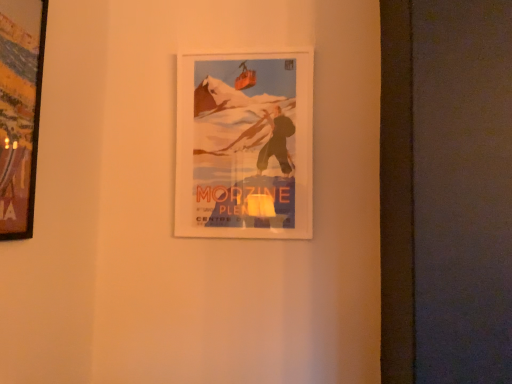
Question: From the image's perspective, is matte paper poster at center, the first picture frame from the right, on top of wooden frame at left, which is counted as the 2th picture frame, starting from the right?

Choices:
 (A) yes
 (B) no

Answer: (B)

Question: Is matte paper poster at center, arranged as the second picture frame when viewed from the left, wider than wooden frame at left, which is counted as the 2th picture frame, starting from the right?

Choices:
 (A) no
 (B) yes

Answer: (A)

Question: Can you see matte paper poster at center, the first picture frame from the right, touching wooden frame at left, which is counted as the 2th picture frame, starting from the right?

Choices:
 (A) yes
 (B) no

Answer: (B)

Question: Is the depth of matte paper poster at center, the first picture frame from the right, greater than that of wooden frame at left, which is counted as the 2th picture frame, starting from the right?

Choices:
 (A) no
 (B) yes

Answer: (B)

Question: Considering the relative sizes of matte paper poster at center, the 2th picture frame viewed from the front, and wooden frame at left, acting as the first picture frame starting from the front, in the image provided, is matte paper poster at center, the 2th picture frame viewed from the front, thinner than wooden frame at left, acting as the first picture frame starting from the front,?

Choices:
 (A) yes
 (B) no

Answer: (A)

Question: Can you confirm if matte paper poster at center, arranged as the second picture frame when viewed from the left, is positioned to the left of wooden frame at left, the 1th picture frame positioned from the left?

Choices:
 (A) no
 (B) yes

Answer: (A)

Question: Would you say wooden frame at left, the 1th picture frame positioned from the left, contains matte paper poster at center, arranged as the second picture frame when viewed from the left?

Choices:
 (A) yes
 (B) no

Answer: (B)

Question: Can we say wooden frame at left, which is counted as the 2th picture frame, starting from the right, lies outside matte paper poster at center, which appears as the first picture frame when viewed from the back?

Choices:
 (A) yes
 (B) no

Answer: (A)

Question: Considering the relative sizes of wooden frame at left, which is counted as the second picture frame, starting from the back, and matte paper poster at center, the 2th picture frame viewed from the front, in the image provided, is wooden frame at left, which is counted as the second picture frame, starting from the back, shorter than matte paper poster at center, the 2th picture frame viewed from the front,?

Choices:
 (A) yes
 (B) no

Answer: (A)

Question: From the image's perspective, is wooden frame at left, which is counted as the 2th picture frame, starting from the right, above matte paper poster at center, arranged as the second picture frame when viewed from the left?

Choices:
 (A) no
 (B) yes

Answer: (B)

Question: Does wooden frame at left, which is counted as the 2th picture frame, starting from the right, come in front of matte paper poster at center, arranged as the second picture frame when viewed from the left?

Choices:
 (A) no
 (B) yes

Answer: (B)

Question: From a real-world perspective, is wooden frame at left, which is counted as the second picture frame, starting from the back, on top of matte paper poster at center, which appears as the first picture frame when viewed from the back?

Choices:
 (A) no
 (B) yes

Answer: (A)

Question: From the image's perspective, is matte paper poster at center, which appears as the first picture frame when viewed from the back, above or below wooden frame at left, the 1th picture frame positioned from the left?

Choices:
 (A) below
 (B) above

Answer: (A)